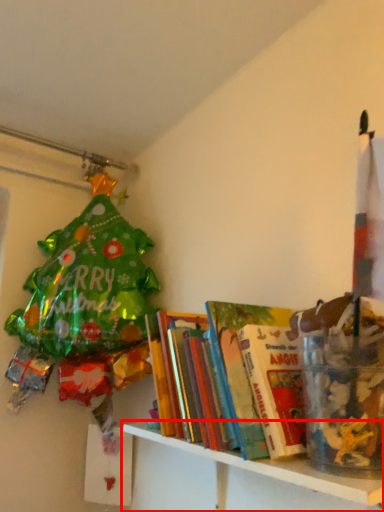
Question: From the image's perspective, where is shelf (annotated by the red box) located relative to shelf?

Choices:
 (A) above
 (B) below

Answer: (B)